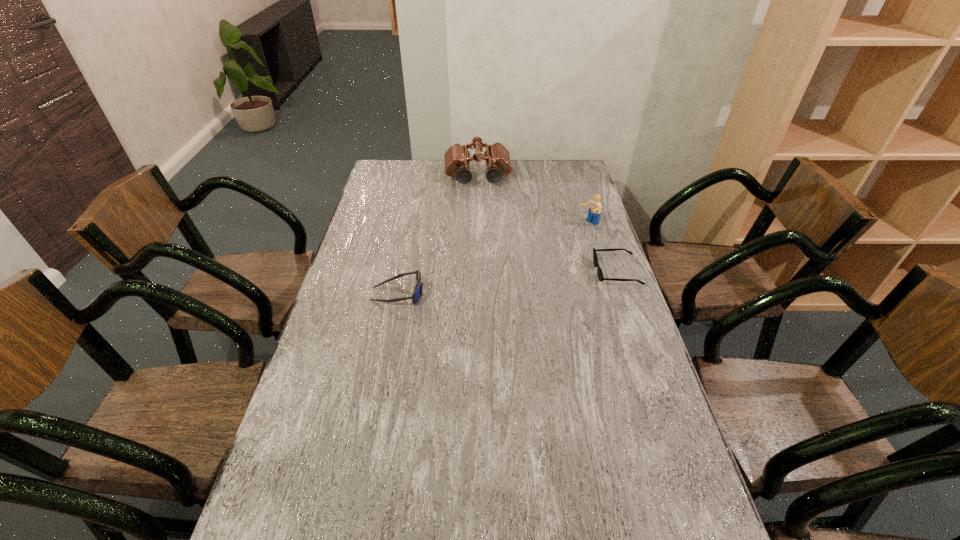
You are a GUI agent. You are given a task and a screenshot of the screen. Output one action in this format:
    pyautogui.click(x=<x>, y=<y>)
    Task: Click on the vacant region that satisfies the following two spatial constraints: 1. on the front side of the shortest object; 2. on the front-facing side of the third nearest object
    
    Given the screenshot: What is the action you would take?
    pyautogui.click(x=604, y=272)